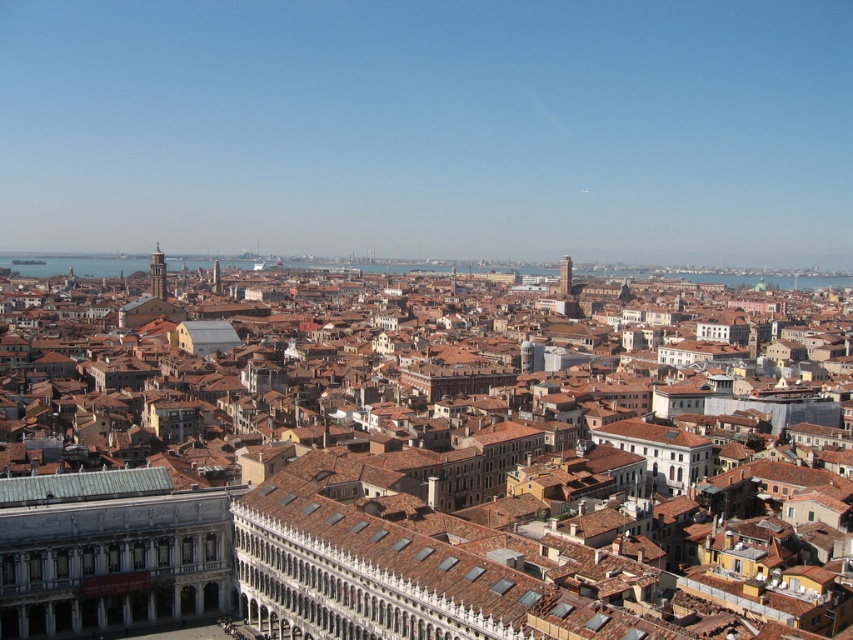
Question: Which point appears farthest from the camera in this image?

Choices:
 (A) pos(155,285)
 (B) pos(137,481)

Answer: (A)

Question: Based on their relative distances, which object is farther from the golden stone tower at upper left?

Choices:
 (A) brown tile roof at center
 (B) smooth stone tower at center
 (C) light brown stone tower at center

Answer: (A)

Question: Which object is positioned farthest from the golden stone tower at upper left?

Choices:
 (A) light brown stone tower at center
 (B) brown tile roof at center
 (C) smooth stone tower at center

Answer: (B)

Question: Does light brown stone tower at center appear on the right side of golden stone tower at upper left?

Choices:
 (A) no
 (B) yes

Answer: (B)

Question: Is light brown stone tower at center to the right of smooth stone tower at center from the viewer's perspective?

Choices:
 (A) no
 (B) yes

Answer: (A)

Question: Does smooth stone tower at center lie in front of golden stone tower at upper left?

Choices:
 (A) no
 (B) yes

Answer: (A)